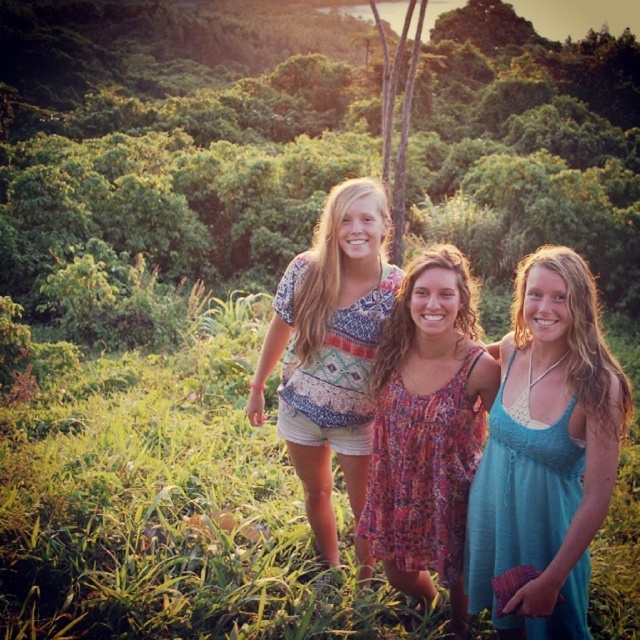
Does blue fabric dress at center appear on the left side of printed cotton shirt at center?

No, blue fabric dress at center is not to the left of printed cotton shirt at center.

Can you confirm if blue fabric dress at center is smaller than printed cotton shirt at center?

Yes.

Locate an element on the screen. The height and width of the screenshot is (640, 640). blue fabric dress at center is located at coordinates [547, 451].

Which is in front, point (456, 580) or point (385, 269)?

Positioned in front is point (456, 580).

Image resolution: width=640 pixels, height=640 pixels. What do you see at coordinates (428, 428) in the screenshot? I see `floral dress at center` at bounding box center [428, 428].

Between point (422, 598) and point (380, 189), which one is positioned in front?

Point (380, 189) is more forward.

Locate an element on the screen. floral dress at center is located at coordinates (428, 428).

Is point (532, 273) behind point (428, 374)?

No, (532, 273) is closer to viewer.

Can you confirm if blue fabric dress at center is positioned below floral dress at center?

Actually, blue fabric dress at center is above floral dress at center.

Which is in front, point (564, 387) or point (412, 428)?

Point (564, 387)

At what (x,y) coordinates should I click in order to perform the action: click on blue fabric dress at center. Please return your answer as a coordinate pair (x, y). Looking at the image, I should click on (547, 451).